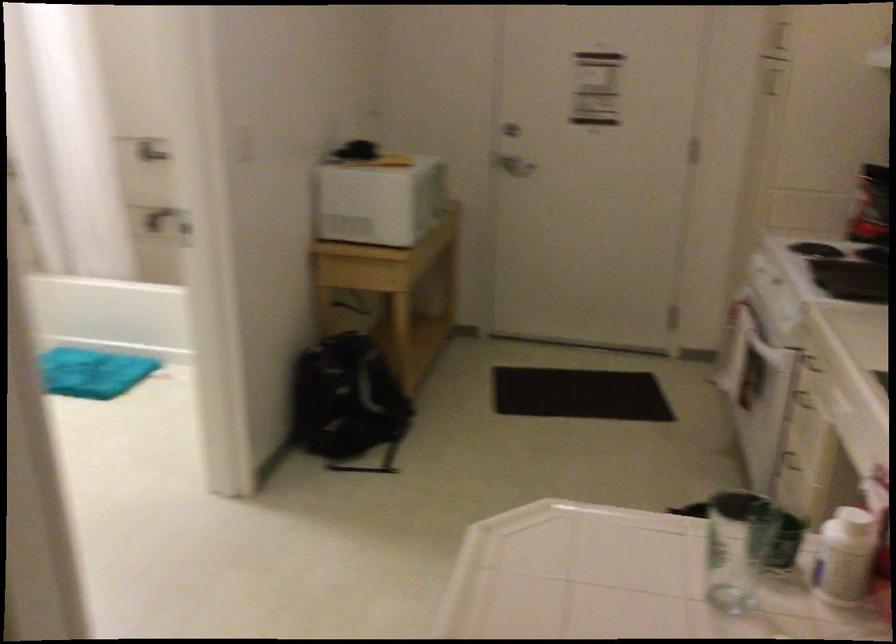
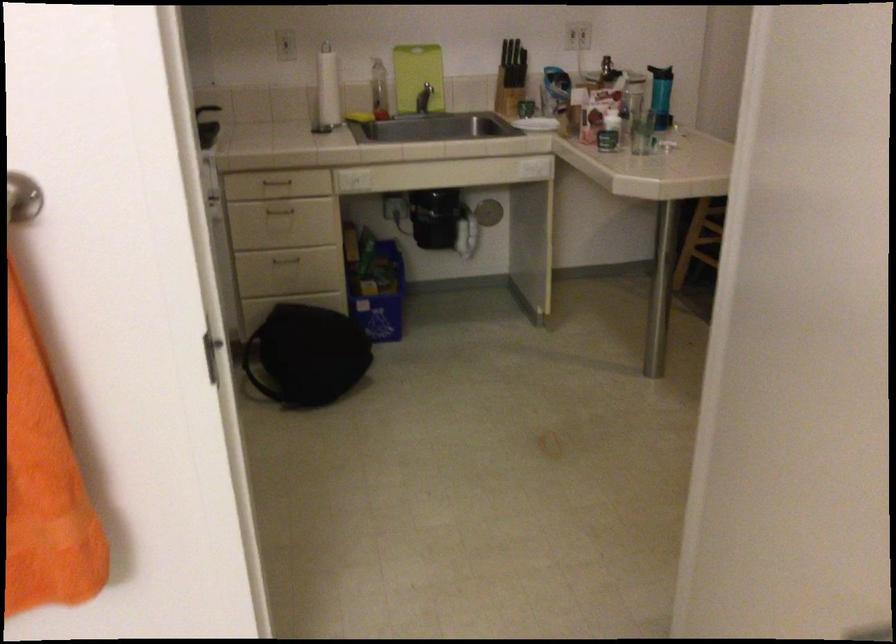
Find the pixel in the second image that matches (816,401) in the first image.

(279, 210)